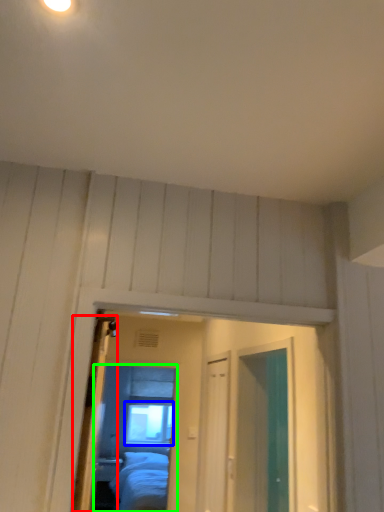
Question: Considering the real-world distances, which object is closest to door (highlighted by a red box)? window (highlighted by a blue box) or mirror (highlighted by a green box).

Choices:
 (A) window
 (B) mirror

Answer: (B)